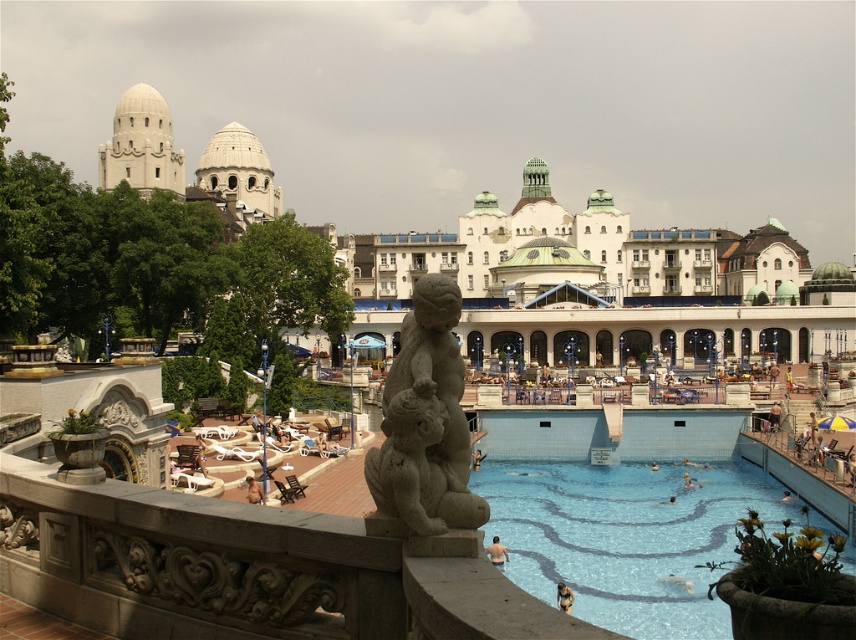
You are a lifeguard on duty and need to ensure safety. You have to check if the blue tile swimming pool at lower right can accommodate a large floating raft that requires a minimum width of 5 meters. The gray stone sculpture at center is 2 meters wide. Can the pool accommodate the raft?

The blue tile swimming pool at lower right might be wider than gray stone sculpture at center which is 2 meters wide. Since the pool could be wider than 2 meters, it is possible that the pool meets the minimum width requirement of 5 meters for the raft. However, without exact measurements, we cannot be certain.

You are standing at the poolside and want to take a photo of both the statue and the lounge chairs. The statue is located at point (765,499) and the lounge chairs are at point (418,307). Since you want both in focus, which point should you focus on to ensure both are sharp?

You should focus on point (418,307) because it is closer to the camera than point (765,499), ensuring that both points are within the depth of field.